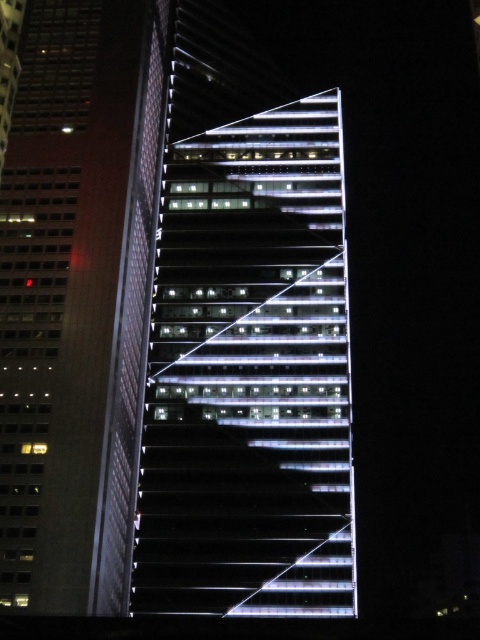
Question: Does white glass building at center appear on the right side of matte glass skyscraper at left?

Choices:
 (A) yes
 (B) no

Answer: (A)

Question: Which object is closer to the camera taking this photo?

Choices:
 (A) matte glass skyscraper at left
 (B) white glass building at center

Answer: (A)

Question: Does white glass building at center appear on the left side of matte glass skyscraper at left?

Choices:
 (A) no
 (B) yes

Answer: (A)

Question: Which point is farther to the camera?

Choices:
 (A) (255, 282)
 (B) (54, 253)

Answer: (A)

Question: Can you confirm if white glass building at center is wider than matte glass skyscraper at left?

Choices:
 (A) no
 (B) yes

Answer: (B)